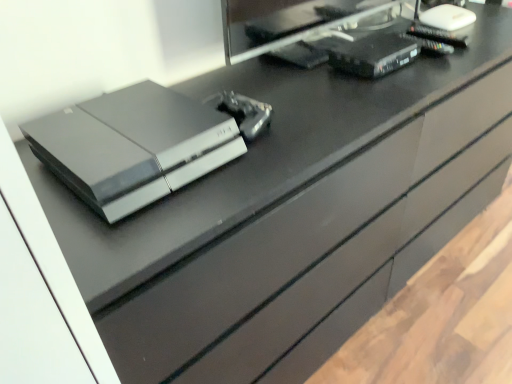
In order to click on free location to the right of satin black console at center in this screenshot , I will do `click(280, 143)`.